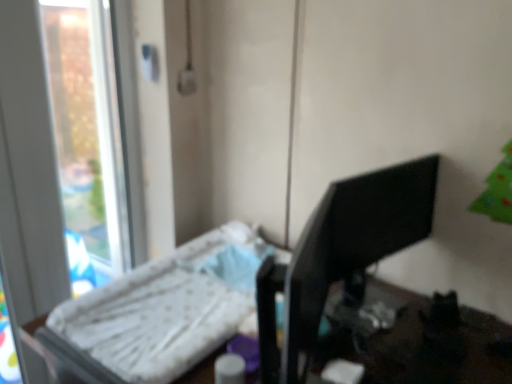
Question: Is the depth of black glossy monitor at right less than that of white fabric changing table at left?

Choices:
 (A) no
 (B) yes

Answer: (A)

Question: From the image's perspective, would you say black glossy monitor at right is positioned over white fabric changing table at left?

Choices:
 (A) no
 (B) yes

Answer: (B)

Question: Can you confirm if black glossy monitor at right is shorter than white fabric changing table at left?

Choices:
 (A) yes
 (B) no

Answer: (A)

Question: Does black glossy monitor at right have a greater height compared to white fabric changing table at left?

Choices:
 (A) yes
 (B) no

Answer: (B)

Question: From a real-world perspective, is black glossy monitor at right under white fabric changing table at left?

Choices:
 (A) yes
 (B) no

Answer: (B)

Question: Relative to transparent glass window at left, is black glossy monitor at right in front or behind?

Choices:
 (A) front
 (B) behind

Answer: (A)

Question: Choose the correct answer: Is black glossy monitor at right inside transparent glass window at left or outside it?

Choices:
 (A) outside
 (B) inside

Answer: (A)

Question: From the image's perspective, is black glossy monitor at right positioned above or below transparent glass window at left?

Choices:
 (A) below
 (B) above

Answer: (A)

Question: Is point (311, 248) positioned closer to the camera than point (15, 306)?

Choices:
 (A) farther
 (B) closer

Answer: (B)

Question: Visually, is white fabric changing table at left positioned to the left or to the right of transparent glass window at left?

Choices:
 (A) right
 (B) left

Answer: (A)

Question: Does point (196, 327) appear closer or farther from the camera than point (67, 99)?

Choices:
 (A) closer
 (B) farther

Answer: (A)

Question: From the image's perspective, is white fabric changing table at left positioned above or below transparent glass window at left?

Choices:
 (A) below
 (B) above

Answer: (A)

Question: In terms of width, does white fabric changing table at left look wider or thinner when compared to transparent glass window at left?

Choices:
 (A) wide
 (B) thin

Answer: (A)

Question: Is black glossy monitor at right spatially inside white fabric changing table at left, or outside of it?

Choices:
 (A) inside
 (B) outside

Answer: (B)

Question: From the image's perspective, is black glossy monitor at right above or below white fabric changing table at left?

Choices:
 (A) above
 (B) below

Answer: (A)